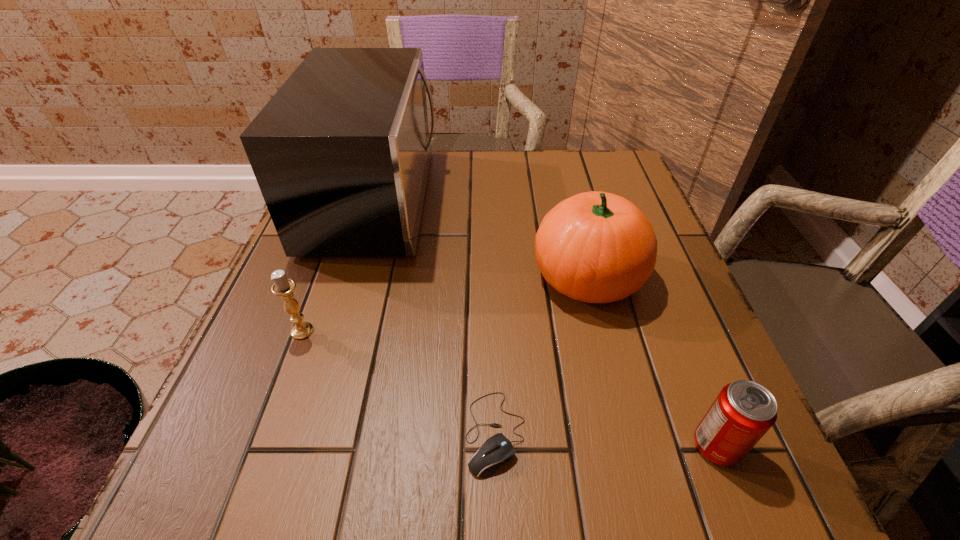
Where is `vacant area at the far edge`? This screenshot has width=960, height=540. vacant area at the far edge is located at coordinates (486, 151).

Find the location of `free region at the near edge`. free region at the near edge is located at coordinates (615, 451).

You are a GUI agent. You are given a task and a screenshot of the screen. Output one action in this format:
    pyautogui.click(x=<x>, y=<y>)
    Task: Click on the vacant area at the left edge of the desktop
    The width and height of the screenshot is (960, 540).
    Given the screenshot: What is the action you would take?
    pyautogui.click(x=315, y=321)

Identify the location of free location at the right edge of the desktop. The width and height of the screenshot is (960, 540). click(x=693, y=298).

This screenshot has width=960, height=540. I want to click on blank space at the far right corner of the desktop, so click(x=589, y=165).

In the image, there is a desktop. Find the location of `free space at the near right corner`. free space at the near right corner is located at coordinates (665, 521).

This screenshot has width=960, height=540. I want to click on free spot between the pumpkin and the third object from right to left, so click(541, 354).

I want to click on vacant point located between the soda can and the third farthest object, so click(x=510, y=388).

Identify the location of vacant area that lies between the microwave oven and the pumpkin. (482, 238).

The width and height of the screenshot is (960, 540). In order to click on free point between the microwave oven and the pumpkin in this screenshot , I will do `click(482, 238)`.